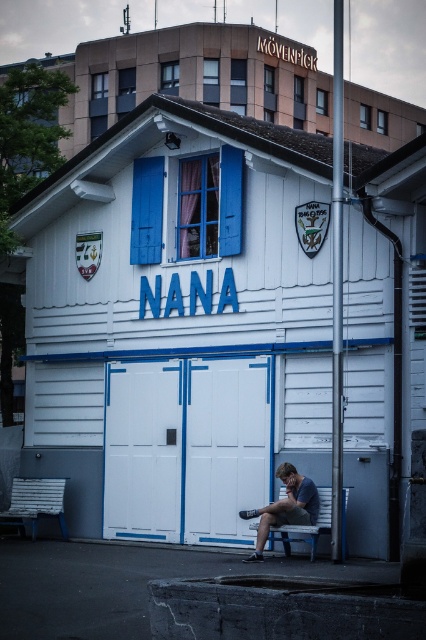
Looking at this image, is white painted wood garage door at center to the right of wooden park bench at lower left from the viewer's perspective?

Yes, white painted wood garage door at center is to the right of wooden park bench at lower left.

From the picture: Does white painted wood garage door at center have a larger size compared to wooden park bench at lower left?

→ Yes, white painted wood garage door at center is bigger than wooden park bench at lower left.

Describe the element at coordinates (186, 449) in the screenshot. I see `white painted wood garage door at center` at that location.

Locate an element on the screen. This screenshot has height=640, width=426. white painted wood garage door at center is located at coordinates (186, 449).

Based on the photo, does white painted wood garage door at center appear over blue wooden bench at lower center?

Correct, white painted wood garage door at center is located above blue wooden bench at lower center.

Is white painted wood garage door at center further to the viewer compared to blue wooden bench at lower center?

Yes, white painted wood garage door at center is behind blue wooden bench at lower center.

Between point (109, 484) and point (322, 524), which one is positioned behind?

Positioned behind is point (109, 484).

Find the location of a particular element. white painted wood garage door at center is located at coordinates (186, 449).

Is white wooden shed at center behind blue wooden bench at lower center?

No, it is in front of blue wooden bench at lower center.

Does point (75, 392) come behind point (344, 493)?

That is True.

Who is more distant from viewer, (242,529) or (345,540)?

Positioned behind is point (242,529).

The image size is (426, 640). I want to click on white wooden shed at center, so click(x=178, y=321).